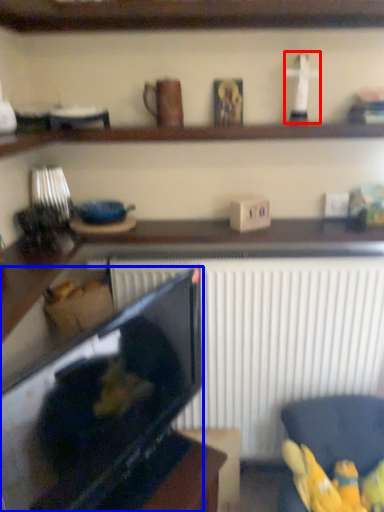
Question: Which object is closer to the camera taking this photo, toy (highlighted by a red box) or appliance (highlighted by a blue box)?

Choices:
 (A) toy
 (B) appliance

Answer: (B)